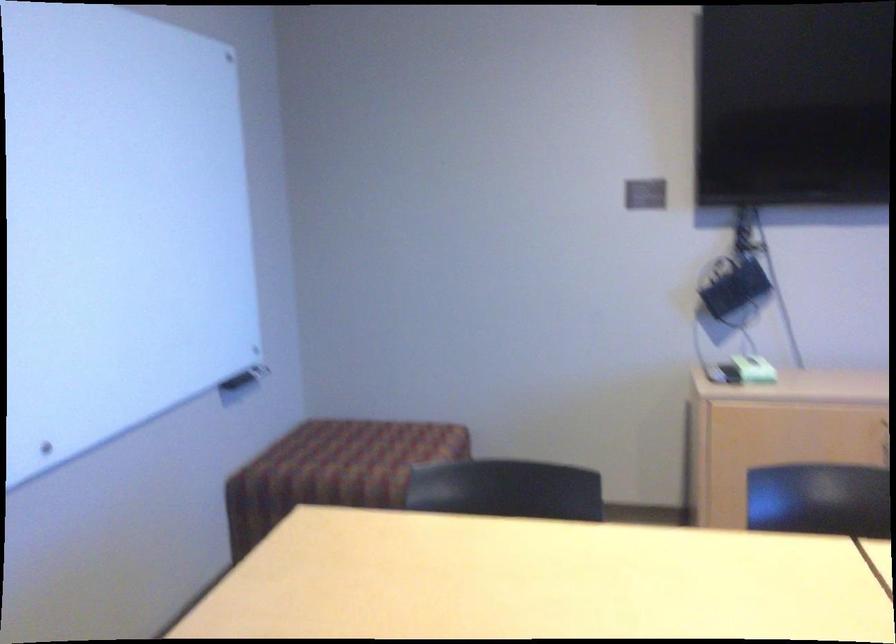
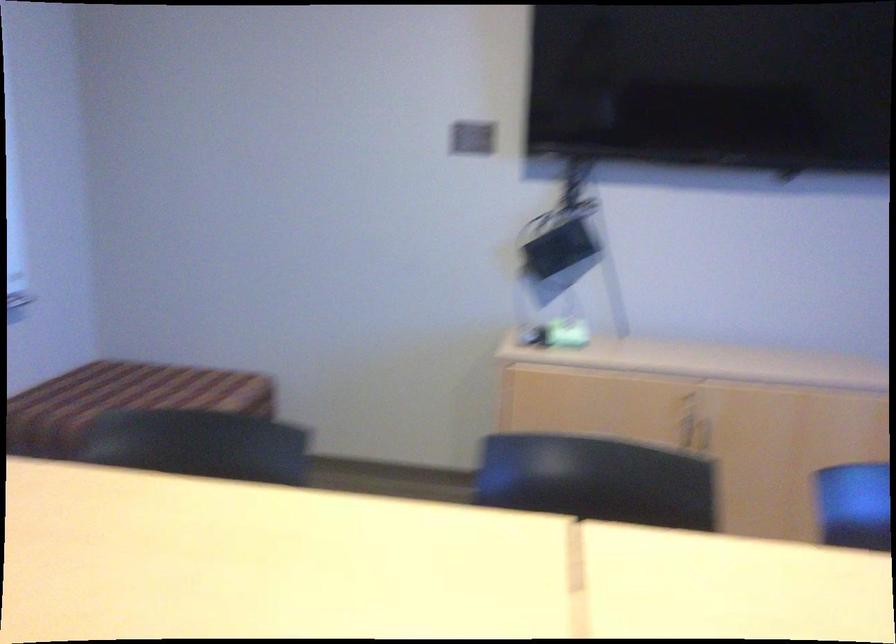
What movement of the cameraman would produce the second image?

The movement direction of the cameraman is right, forward.